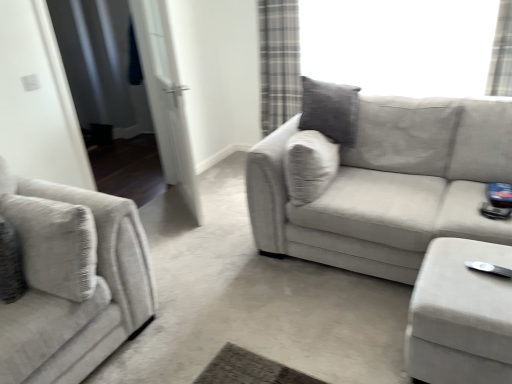
Where is `free space to the back side of white plastic wii controller at lower right`? The image size is (512, 384). free space to the back side of white plastic wii controller at lower right is located at coordinates (472, 246).